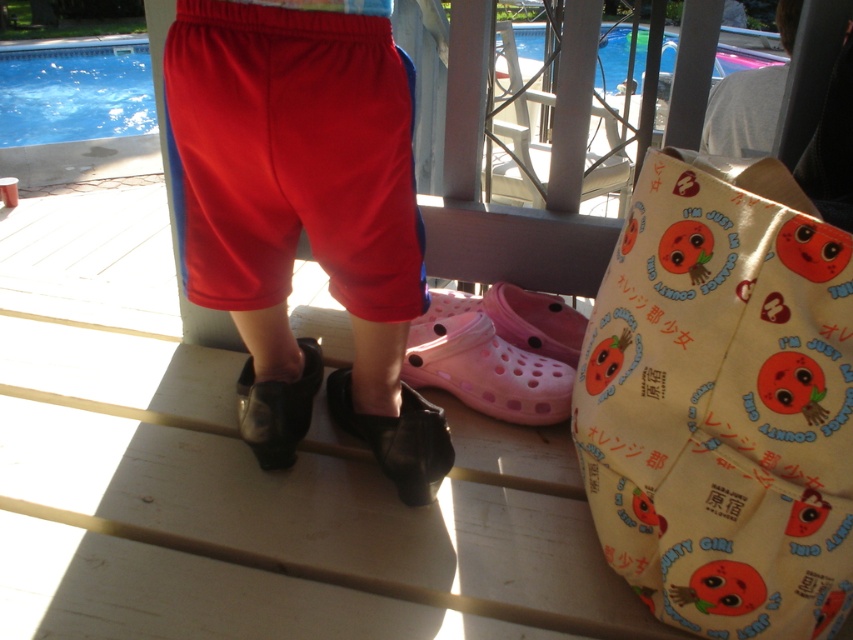
Identify the location of red matte shorts at center. This screenshot has width=853, height=640. (303, 216).

Does red matte shorts at center have a smaller size compared to pink rubber clog at center?

Actually, red matte shorts at center might be larger than pink rubber clog at center.

Between point (236, 212) and point (469, 380), which one is positioned in front?

Positioned in front is point (236, 212).

The height and width of the screenshot is (640, 853). I want to click on red matte shorts at center, so coord(303,216).

Is blue glossy water at upper left bigger than blue glossy water at upper center?

Yes.

In the scene shown: Does blue glossy water at upper left have a smaller size compared to blue glossy water at upper center?

Incorrect, blue glossy water at upper left is not smaller in size than blue glossy water at upper center.

Does point (83, 42) lie behind point (531, 35)?

Yes.

You are a GUI agent. You are given a task and a screenshot of the screen. Output one action in this format:
    pyautogui.click(x=<x>, y=<y>)
    Task: Click on the blue glossy water at upper left
    The width and height of the screenshot is (853, 640).
    Given the screenshot: What is the action you would take?
    pyautogui.click(x=74, y=92)

Is the position of red matte shorts at center less distant than that of blue glossy water at upper left?

Yes, red matte shorts at center is in front of blue glossy water at upper left.

The height and width of the screenshot is (640, 853). What do you see at coordinates (303, 216) in the screenshot?
I see `red matte shorts at center` at bounding box center [303, 216].

Describe the element at coordinates (303, 216) in the screenshot. I see `red matte shorts at center` at that location.

You are a GUI agent. You are given a task and a screenshot of the screen. Output one action in this format:
    pyautogui.click(x=<x>, y=<y>)
    Task: Click on the red matte shorts at center
    Image resolution: width=853 pixels, height=640 pixels.
    Given the screenshot: What is the action you would take?
    pyautogui.click(x=303, y=216)